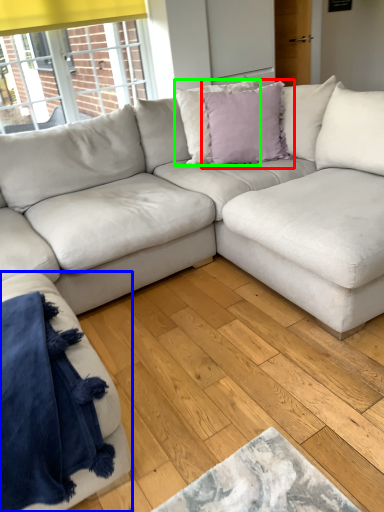
Question: Which object is positioned farthest from pillow (highlighted by a red box)? Select from studio couch (highlighted by a blue box) and pillow (highlighted by a green box).

Choices:
 (A) studio couch
 (B) pillow

Answer: (A)